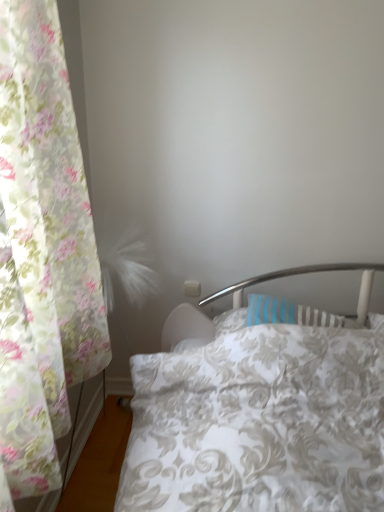
Question: From the image's perspective, is white floral duvet at center positioned above or below floral sheer curtain at left?

Choices:
 (A) below
 (B) above

Answer: (A)

Question: Considering the positions of white floral duvet at center and floral sheer curtain at left in the image, is white floral duvet at center taller or shorter than floral sheer curtain at left?

Choices:
 (A) short
 (B) tall

Answer: (A)

Question: From a real-world perspective, is white floral duvet at center physically located above or below floral sheer curtain at left?

Choices:
 (A) below
 (B) above

Answer: (A)

Question: In terms of width, does floral sheer curtain at left look wider or thinner when compared to white floral duvet at center?

Choices:
 (A) wide
 (B) thin

Answer: (B)

Question: Is floral sheer curtain at left taller or shorter than white floral duvet at center?

Choices:
 (A) short
 (B) tall

Answer: (B)

Question: Which is correct: floral sheer curtain at left is inside white floral duvet at center, or outside of it?

Choices:
 (A) outside
 (B) inside

Answer: (A)

Question: From a real-world perspective, is floral sheer curtain at left physically located above or below white floral duvet at center?

Choices:
 (A) above
 (B) below

Answer: (A)